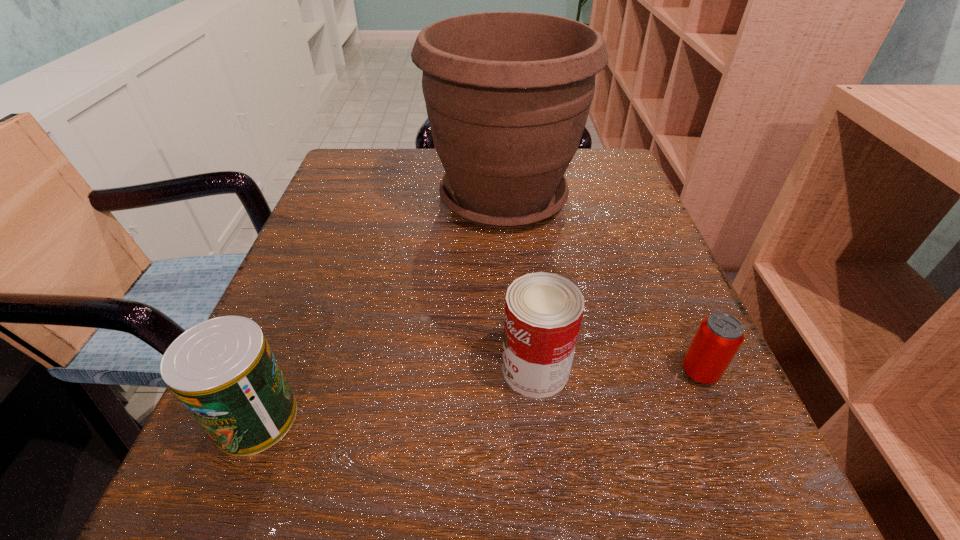
Identify the location of the tallest object. (507, 94).

Image resolution: width=960 pixels, height=540 pixels. I want to click on flowerpot, so click(x=507, y=94).

Where is `the second can from right to left`? the second can from right to left is located at coordinates (543, 311).

Identify the location of the leftmost object. This screenshot has width=960, height=540. (223, 371).

The width and height of the screenshot is (960, 540). Identify the location of the rightmost object. (719, 336).

Image resolution: width=960 pixels, height=540 pixels. What are the coordinates of `the shortest can` in the screenshot? It's located at (719, 336).

Find the location of a particular element. The height and width of the screenshot is (540, 960). vacant area situated 0.120m on the left of the flowerpot is located at coordinates (369, 198).

Where is `free space located 0.240m on the front label of the second can from left to right`? The height and width of the screenshot is (540, 960). free space located 0.240m on the front label of the second can from left to right is located at coordinates pos(328,369).

Identify the location of free space located on the front label of the second can from left to right. Image resolution: width=960 pixels, height=540 pixels. (285, 369).

Locate an element on the screen. The image size is (960, 540). free region located on the front label of the second can from left to right is located at coordinates (242, 369).